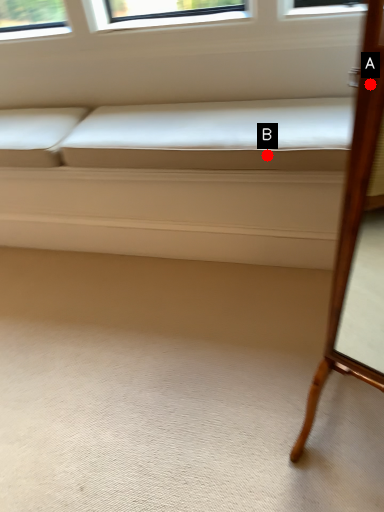
Question: Two points are circled on the image, labeled by A and B beside each circle. Which point appears farthest from the camera in this image?

Choices:
 (A) A is further
 (B) B is further

Answer: (B)